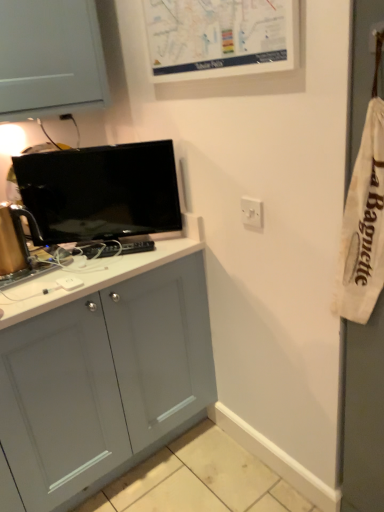
Question: Could you tell me if white matte map at upper center is facing white plastic switch at upper right?

Choices:
 (A) no
 (B) yes

Answer: (A)

Question: Is white matte map at upper center closer to camera compared to white plastic switch at upper right?

Choices:
 (A) no
 (B) yes

Answer: (B)

Question: Can you confirm if white matte map at upper center is thinner than white plastic switch at upper right?

Choices:
 (A) no
 (B) yes

Answer: (A)

Question: Does white matte map at upper center have a greater width compared to white plastic switch at upper right?

Choices:
 (A) yes
 (B) no

Answer: (A)

Question: Is white matte map at upper center bigger than white plastic switch at upper right?

Choices:
 (A) yes
 (B) no

Answer: (A)

Question: Would you say white matte map at upper center is to the left or to the right of matte black tv at upper left in the picture?

Choices:
 (A) right
 (B) left

Answer: (A)

Question: Is point (173, 28) closer or farther from the camera than point (64, 197)?

Choices:
 (A) closer
 (B) farther

Answer: (A)

Question: In terms of size, does white matte map at upper center appear bigger or smaller than matte black tv at upper left?

Choices:
 (A) small
 (B) big

Answer: (A)

Question: From a real-world perspective, is white matte map at upper center physically located above or below matte black tv at upper left?

Choices:
 (A) above
 (B) below

Answer: (A)

Question: Visually, is matte black tv at upper left positioned to the left or to the right of white plastic switch at upper right?

Choices:
 (A) right
 (B) left

Answer: (B)

Question: Based on their sizes in the image, would you say matte black tv at upper left is bigger or smaller than white plastic switch at upper right?

Choices:
 (A) small
 (B) big

Answer: (B)

Question: Do you think matte black tv at upper left is within white plastic switch at upper right, or outside of it?

Choices:
 (A) inside
 (B) outside

Answer: (B)

Question: From a real-world perspective, relative to white plastic switch at upper right, is matte black tv at upper left vertically above or below?

Choices:
 (A) below
 (B) above

Answer: (B)

Question: Visually, is white matte map at upper center positioned to the left or to the right of white plastic switch at upper right?

Choices:
 (A) right
 (B) left

Answer: (B)

Question: Is white matte map at upper center in front of or behind white plastic switch at upper right in the image?

Choices:
 (A) front
 (B) behind

Answer: (A)